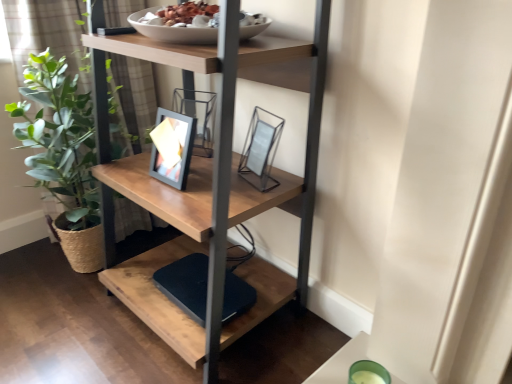
Question: Considering the positions of point (248, 190) and point (128, 122), is point (248, 190) closer or farther from the camera than point (128, 122)?

Choices:
 (A) farther
 (B) closer

Answer: (B)

Question: Do you think wooden shelf at center is within green leafy plant at left, or outside of it?

Choices:
 (A) outside
 (B) inside

Answer: (A)

Question: Considering the real-world distances, which object is closest to the wooden shelf at center?

Choices:
 (A) green leafy plant at left
 (B) black matte lift at lower center
 (C) metallic glass picture frame at center

Answer: (C)

Question: Which is nearer to the wooden shelf at center?

Choices:
 (A) green leafy plant at left
 (B) metallic glass picture frame at center
 (C) black matte lift at lower center

Answer: (B)